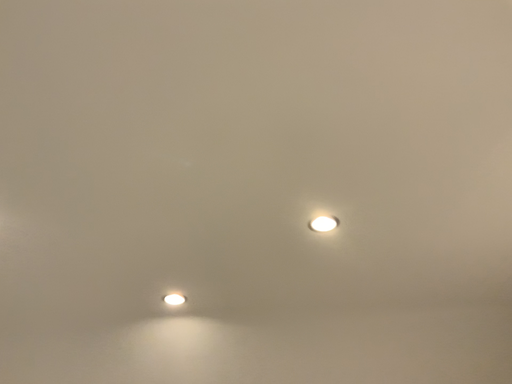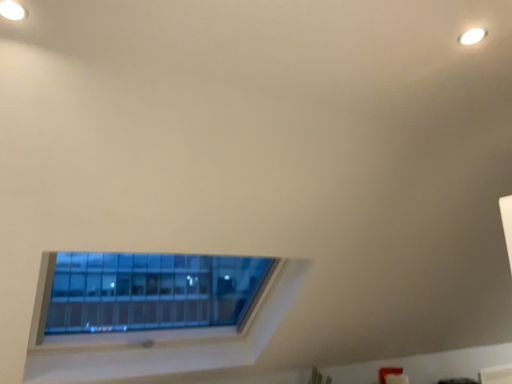
Question: Which way did the camera rotate in the video?

Choices:
 (A) rotated upward
 (B) rotated downward

Answer: (B)